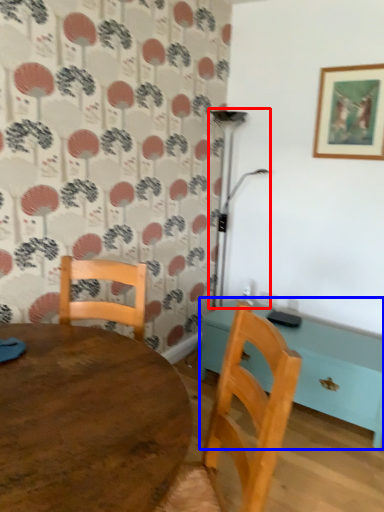
Question: Which point is further to the camera, lamp (highlighted by a red box) or table (highlighted by a blue box)?

Choices:
 (A) lamp
 (B) table

Answer: (A)